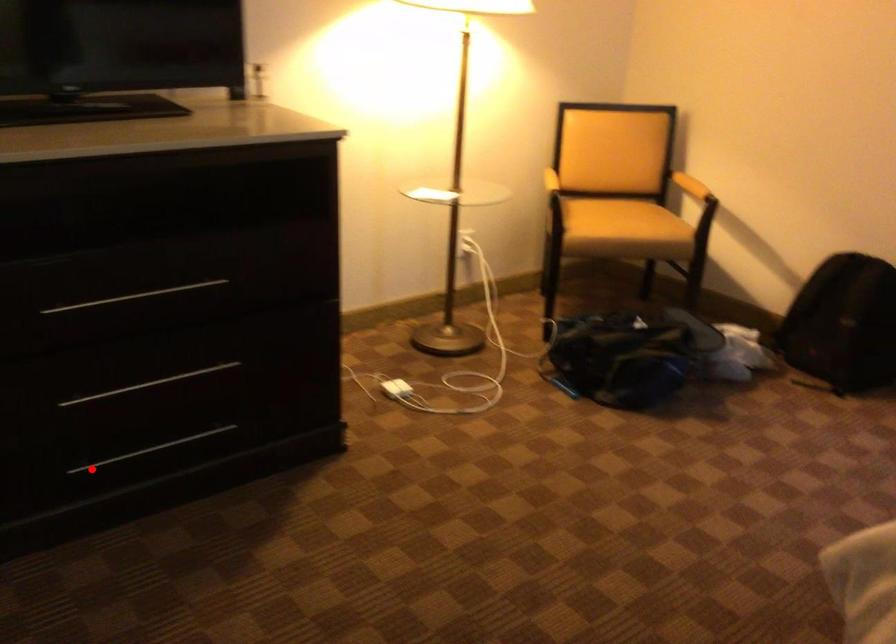
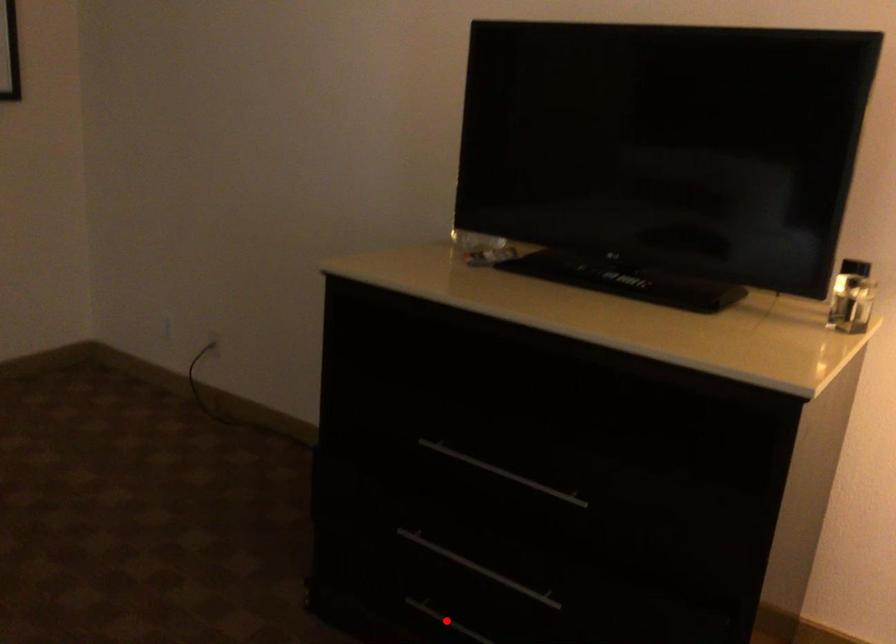
I am providing you with two images of the same scene from different viewpoints. A red point is marked on the first image and another point is marked on the second image. Do the highlighted points in image1 and image2 indicate the same real-world spot?

Yes